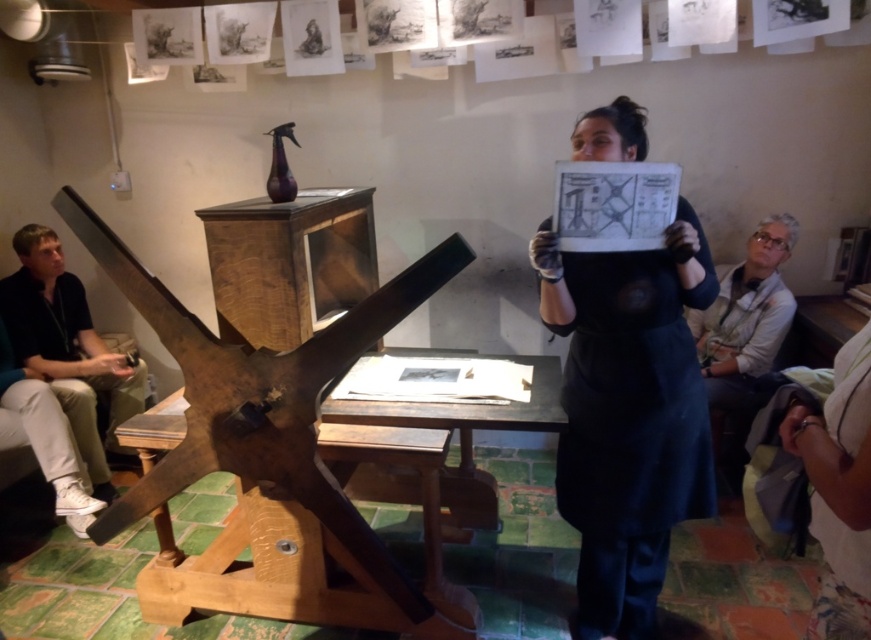
Question: Can you confirm if black matte dress at center is positioned to the left of white shirt at right?

Choices:
 (A) yes
 (B) no

Answer: (A)

Question: Which point is closer to the camera taking this photo?

Choices:
 (A) tap(689, 456)
 (B) tap(41, 323)
 (C) tap(701, 314)

Answer: (A)

Question: Does black cotton shirt at left appear on the left side of white shirt at right?

Choices:
 (A) no
 (B) yes

Answer: (B)

Question: Is black cotton shirt at left wider than white shirt at right?

Choices:
 (A) yes
 (B) no

Answer: (A)

Question: Which object appears closest to the camera in this image?

Choices:
 (A) black cotton shirt at left
 (B) white shirt at right
 (C) rusty wood easel at center

Answer: (C)

Question: Which point is closer to the camera?

Choices:
 (A) black matte dress at center
 (B) black cotton shirt at left
 (C) rusty wood easel at center
 (D) white shirt at right

Answer: (C)